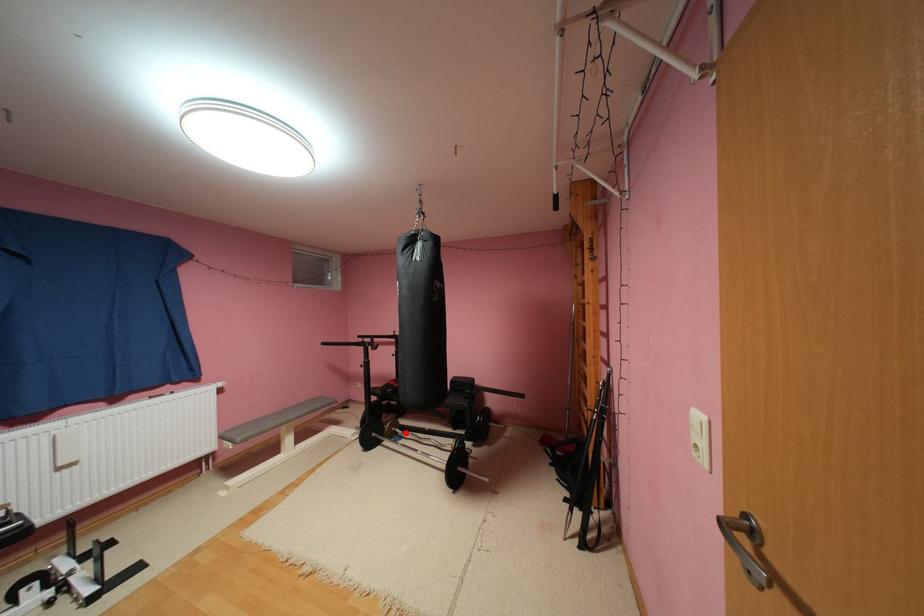
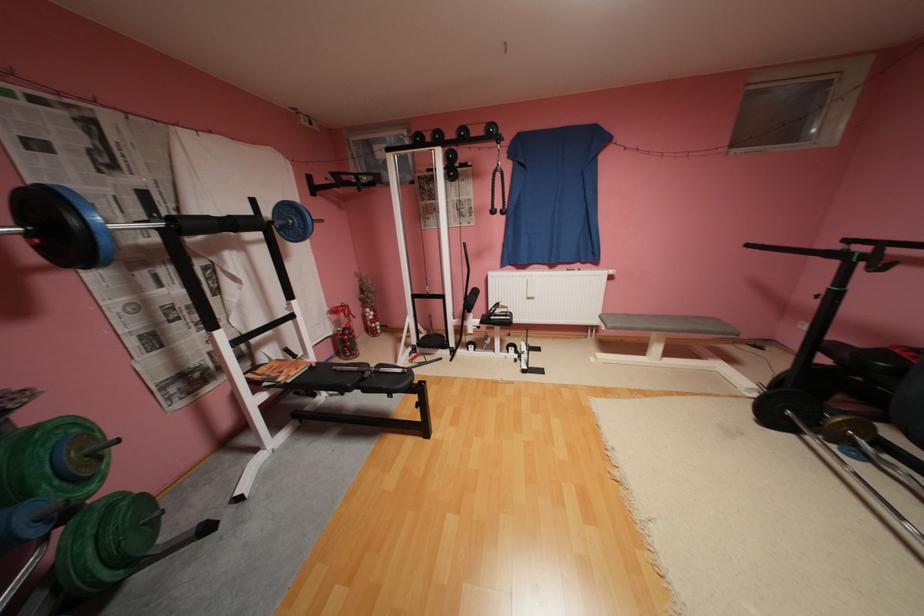
Question: I am providing you with two images of the same scene from different viewpoints. In image1, a red point is highlighted. Considering the same 3D point in image2, which of the following is correct?

Choices:
 (A) It is closer
 (B) It is farther

Answer: (A)